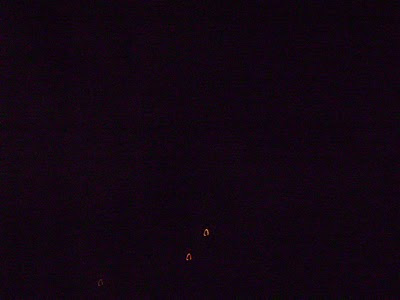
Locate an element on the screen. This screenshot has height=300, width=400. lights is located at coordinates (190, 255), (205, 233), (101, 282).